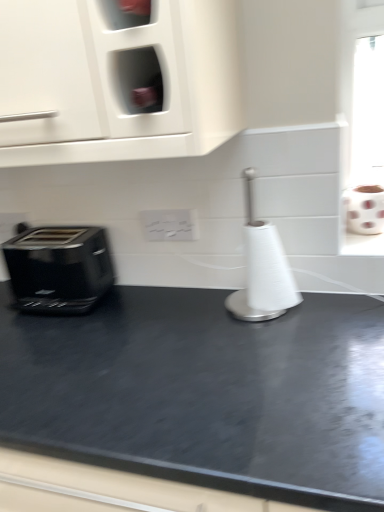
Question: Is white matte toilet paper at right further to camera compared to white paper towel holder at center?

Choices:
 (A) no
 (B) yes

Answer: (B)

Question: Does white matte toilet paper at right have a greater height compared to white paper towel holder at center?

Choices:
 (A) yes
 (B) no

Answer: (B)

Question: Is white matte toilet paper at right far from white paper towel holder at center?

Choices:
 (A) yes
 (B) no

Answer: (B)

Question: Is white matte toilet paper at right positioned in front of white paper towel holder at center?

Choices:
 (A) yes
 (B) no

Answer: (B)

Question: From the image's perspective, is white matte toilet paper at right located above white paper towel holder at center?

Choices:
 (A) no
 (B) yes

Answer: (B)

Question: Which is correct: white glossy electric outlet at center is inside white paper towel holder at center, or outside of it?

Choices:
 (A) inside
 (B) outside

Answer: (B)

Question: Is point (147, 222) closer or farther from the camera than point (258, 250)?

Choices:
 (A) farther
 (B) closer

Answer: (A)

Question: Looking at their shapes, would you say white glossy electric outlet at center is wider or thinner than white paper towel holder at center?

Choices:
 (A) thin
 (B) wide

Answer: (A)

Question: From a real-world perspective, relative to white paper towel holder at center, is white glossy electric outlet at center vertically above or below?

Choices:
 (A) above
 (B) below

Answer: (A)

Question: Does point (279, 253) appear closer or farther from the camera than point (170, 233)?

Choices:
 (A) closer
 (B) farther

Answer: (A)

Question: From the image's perspective, is white paper towel holder at center above or below white glossy electric outlet at center?

Choices:
 (A) above
 (B) below

Answer: (B)

Question: From their relative heights in the image, would you say white paper towel holder at center is taller or shorter than white glossy electric outlet at center?

Choices:
 (A) short
 (B) tall

Answer: (B)

Question: In terms of width, does white paper towel holder at center look wider or thinner when compared to white glossy electric outlet at center?

Choices:
 (A) wide
 (B) thin

Answer: (A)

Question: Considering the positions of white paper towel holder at center and black glossy toaster at left in the image, is white paper towel holder at center bigger or smaller than black glossy toaster at left?

Choices:
 (A) small
 (B) big

Answer: (B)

Question: Which is correct: white paper towel holder at center is inside black glossy toaster at left, or outside of it?

Choices:
 (A) outside
 (B) inside

Answer: (A)